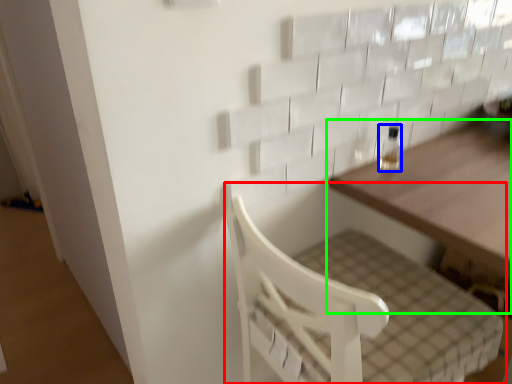
Question: Based on their relative distances, which object is farther from furniture (highlighted by a red box)? Choose from bottle (highlighted by a blue box) and table (highlighted by a green box).

Choices:
 (A) bottle
 (B) table

Answer: (A)